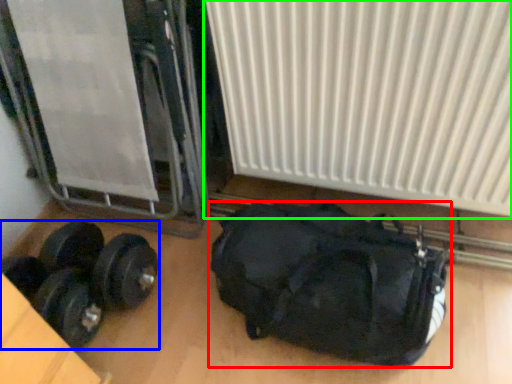
Question: Which is nearer to the luggage and bags (highlighted by a red box)? dumbbell (highlighted by a blue box) or radiator (highlighted by a green box).

Choices:
 (A) dumbbell
 (B) radiator

Answer: (B)